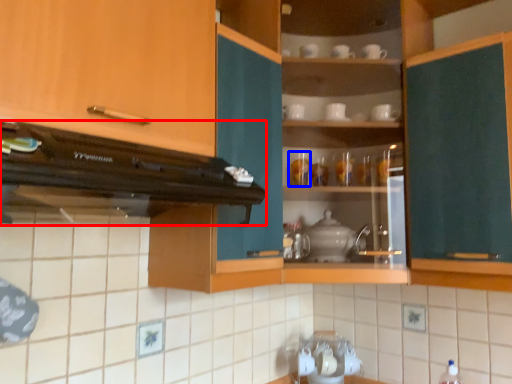
Question: Which object is closer to the camera taking this photo, home appliance (highlighted by a red box) or tableware (highlighted by a blue box)?

Choices:
 (A) home appliance
 (B) tableware

Answer: (A)